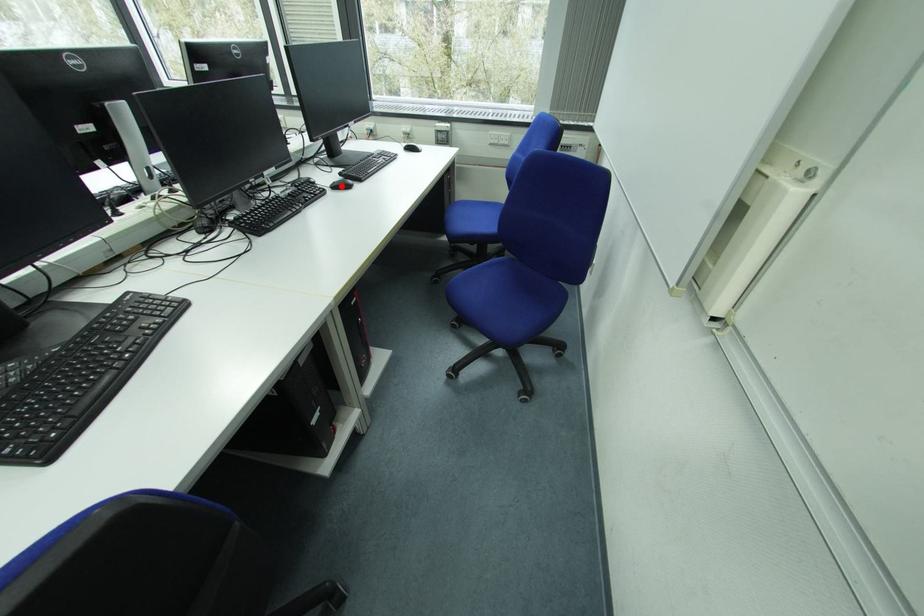
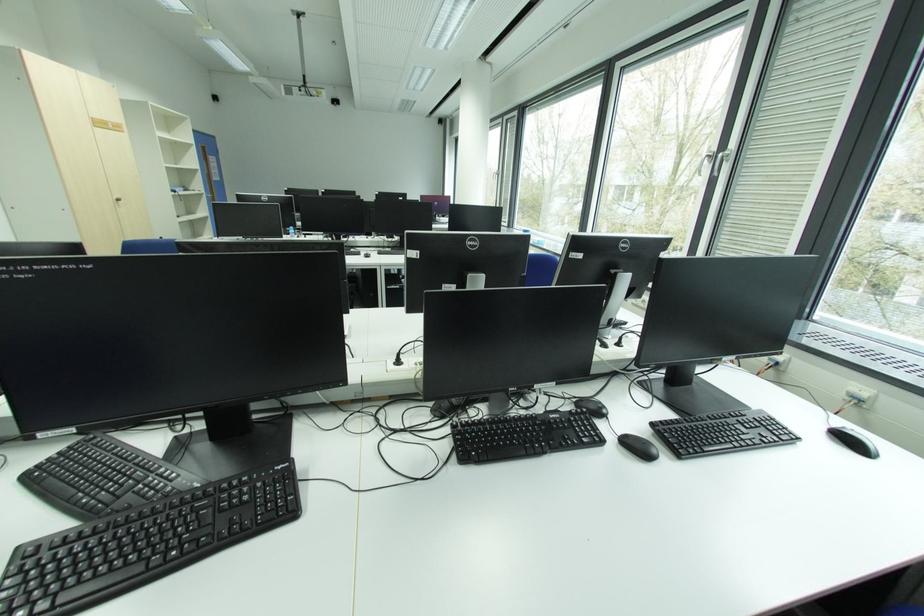
Where in the second image is the point corresponding to the highlighted location from the first image?

(634, 442)